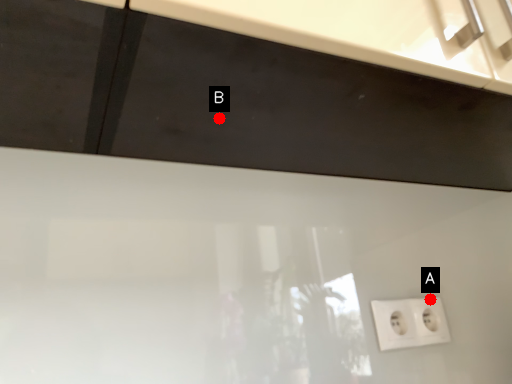
Question: Two points are circled on the image, labeled by A and B beside each circle. Among these points, which one is farthest from the camera?

Choices:
 (A) A is further
 (B) B is further

Answer: (A)